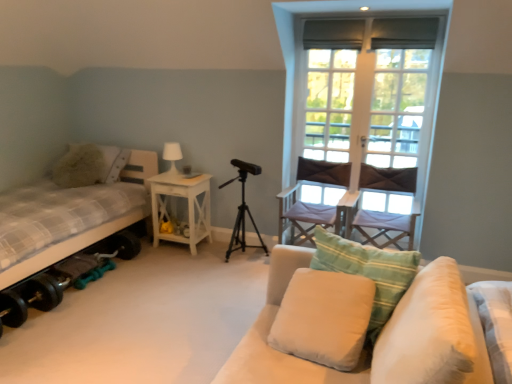
Find the location of `vacant space in front of black matte tripod at center`. vacant space in front of black matte tripod at center is located at coordinates (239, 279).